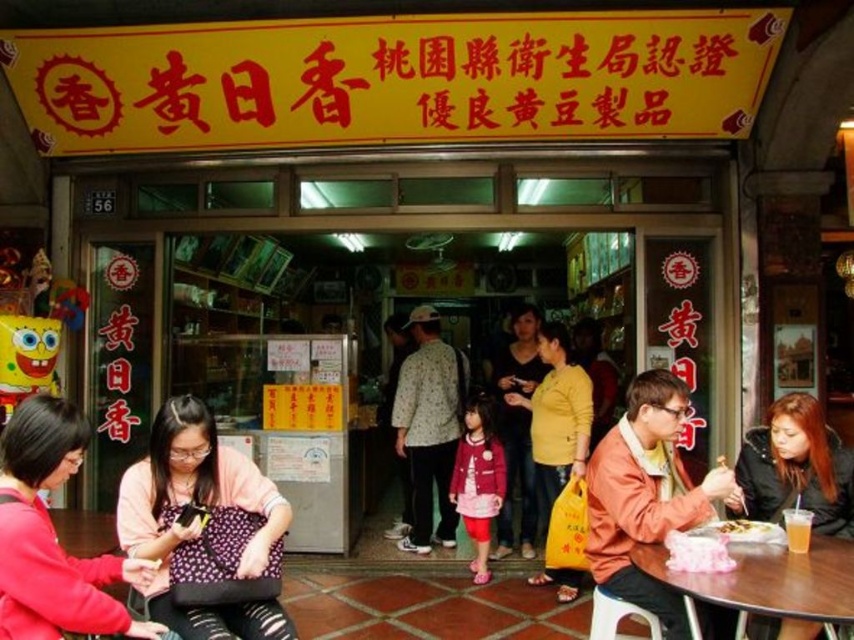
Question: Does wooden table at lower right appear under white paper plate at lower center?

Choices:
 (A) no
 (B) yes

Answer: (B)

Question: Is patterned fabric bag at center positioned in front of white plastic stool at lower right?

Choices:
 (A) no
 (B) yes

Answer: (B)

Question: Which object is farther from the camera taking this photo?

Choices:
 (A) white plastic stool at lower right
 (B) wooden table at lower right
 (C) matte purple shirt at center

Answer: (A)

Question: Estimate the real-world distances between objects in this image. Which object is closer to the wooden table at lower right?

Choices:
 (A) dark brown leather jacket at lower right
 (B) matte black shirt at center

Answer: (A)

Question: Which object is closer to the camera taking this photo?

Choices:
 (A) matte black shirt at center
 (B) white paper plate at lower center
 (C) matte purple shirt at center

Answer: (C)

Question: Can you confirm if wooden table at lower right is wider than white paper plate at lower center?

Choices:
 (A) yes
 (B) no

Answer: (A)